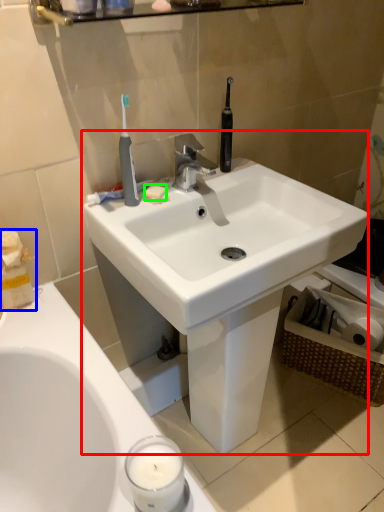
Question: Considering the real-world distances, which object is farthest from sink (highlighted by a red box)? tissue (highlighted by a blue box) or soap (highlighted by a green box)?

Choices:
 (A) tissue
 (B) soap

Answer: (A)